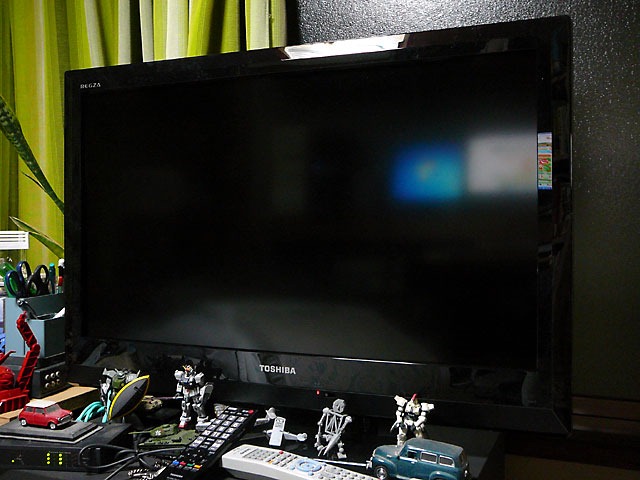
Locate an element on the screen. This screenshot has height=480, width=640. corner is located at coordinates (566, 19), (66, 71), (571, 435).